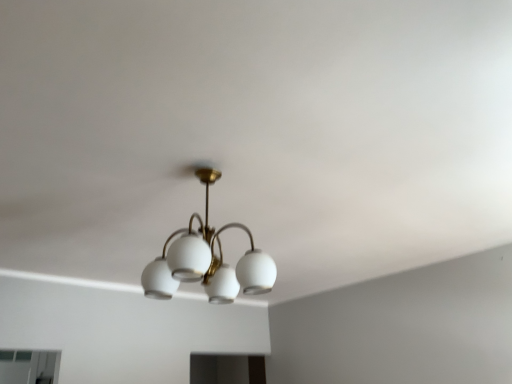
Question: Should I look upward or downward to see matte white chandelier at center?

Choices:
 (A) down
 (B) up

Answer: (A)